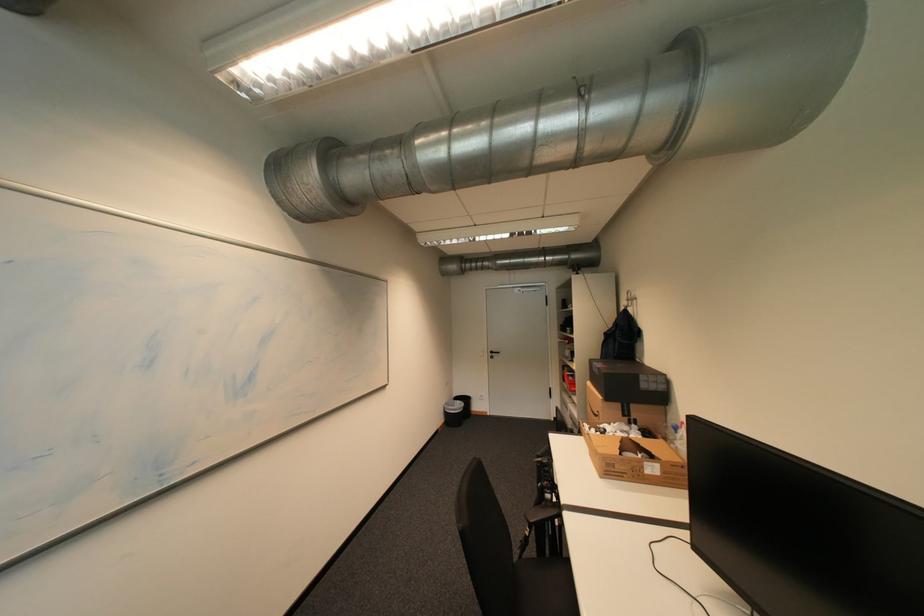
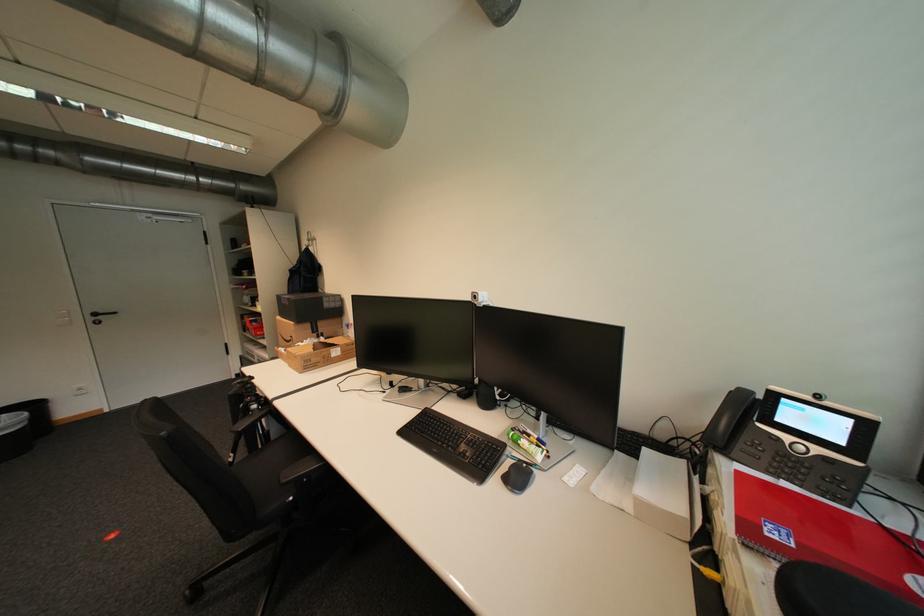
Question: The camera is either moving clockwise (left) or counter-clockwise (right) around the object. The first image is from the beginning of the video and the second image is from the end. Is the camera moving left or right when shooting the video?

Choices:
 (A) Left
 (B) Right

Answer: (A)